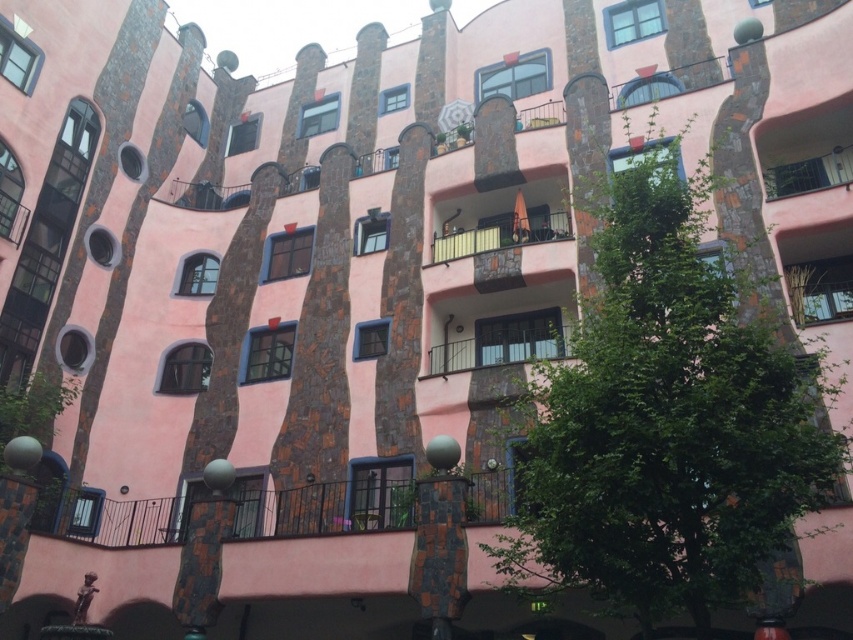
Is green leafy tree at center shorter than black metal railing at center?

Incorrect, green leafy tree at center's height does not fall short of black metal railing at center's.

Is green leafy tree at center thinner than black metal railing at center?

No.

Find the location of a particular element. Image resolution: width=853 pixels, height=640 pixels. green leafy tree at center is located at coordinates (666, 417).

Find the location of a particular element. green leafy tree at center is located at coordinates (666, 417).

Is point (614, 180) less distant than point (527, 240)?

Yes, point (614, 180) is closer to viewer.

Is point (608, 304) farther from viewer compared to point (543, 225)?

No, it is not.

I want to click on green leafy tree at center, so click(x=666, y=417).

Find the location of `green leafy tree at center`. green leafy tree at center is located at coordinates (666, 417).

Is black metal railing at center taller than pink stone balcony at center?

Incorrect, black metal railing at center's height is not larger of pink stone balcony at center's.

Between black metal railing at center and pink stone balcony at center, which one is positioned higher?

pink stone balcony at center is above.

Is point (529, 342) positioned behind point (451, 237)?

No.

This screenshot has height=640, width=853. Find the location of `black metal railing at center`. black metal railing at center is located at coordinates (500, 344).